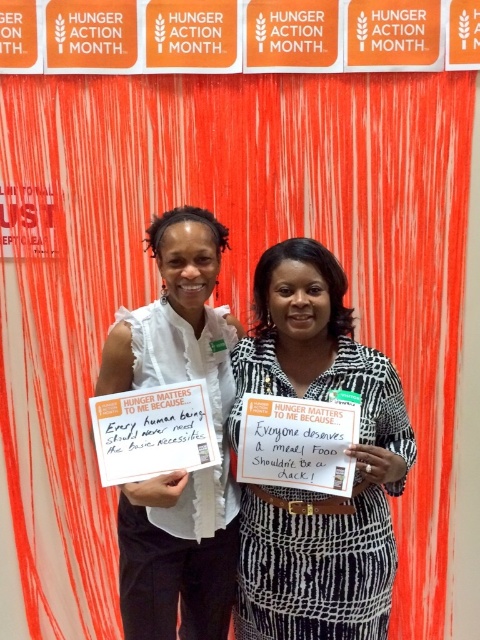
You are a photographer trying to capture both the white printed signboard at center and the white paper sign at center in a single frame. Which sign should you focus on first to ensure both are in focus?

You should focus on the white printed signboard at center first because it is closer to the viewer than the white paper sign at center, allowing the camera to adjust for depth of field so both can be in focus.

You are organizing a photo shoot for a hunger awareness campaign. You have two signs, the white printed signboard at center and the white paper sign at center, that need to be placed side by side. The photographer requires a minimum of 20 centimeters between the two signs for proper framing. Based on the current setup, can the signs be positioned as required without moving them?

The distance between the white printed signboard at center and the white paper sign at center is 19.32 centimeters. Since this is less than the required 20 centimeters, the signs cannot be positioned as required without moving them.